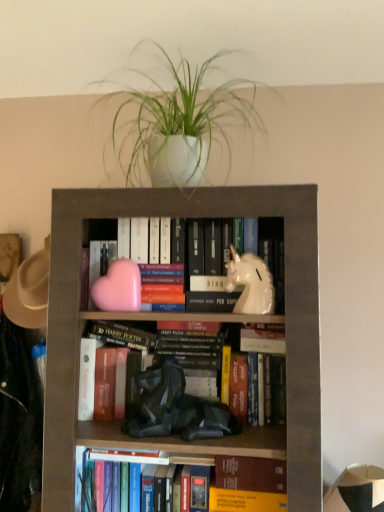
Question: Is brown felt hat at left surrounding white glossy unicorn at center-right, marked as the 1th animal in a right-to-left arrangement?

Choices:
 (A) yes
 (B) no

Answer: (B)

Question: Would you say brown felt hat at left is outside white glossy unicorn at center-right, marked as the 1th animal in a right-to-left arrangement?

Choices:
 (A) no
 (B) yes

Answer: (B)

Question: Considering the relative sizes of brown felt hat at left and white glossy unicorn at center-right, marked as the 1th animal in a right-to-left arrangement, in the image provided, is brown felt hat at left bigger than white glossy unicorn at center-right, marked as the 1th animal in a right-to-left arrangement,?

Choices:
 (A) no
 (B) yes

Answer: (B)

Question: Does brown felt hat at left appear on the right side of white glossy unicorn at center-right, the 2th animal in the left-to-right sequence?

Choices:
 (A) no
 (B) yes

Answer: (A)

Question: Can you confirm if brown felt hat at left is thinner than white glossy unicorn at center-right, marked as the 1th animal in a right-to-left arrangement?

Choices:
 (A) no
 (B) yes

Answer: (A)

Question: From a real-world perspective, is brown felt hat at left under white glossy unicorn at center-right, marked as the 1th animal in a right-to-left arrangement?

Choices:
 (A) no
 (B) yes

Answer: (B)

Question: From the image's perspective, does white matte plant at upper center appear higher than matte gray bookcase at center?

Choices:
 (A) yes
 (B) no

Answer: (A)

Question: Considering the relative positions of white matte plant at upper center and matte gray bookcase at center in the image provided, is white matte plant at upper center to the right of matte gray bookcase at center from the viewer's perspective?

Choices:
 (A) yes
 (B) no

Answer: (B)

Question: From the image's perspective, is white matte plant at upper center under matte gray bookcase at center?

Choices:
 (A) no
 (B) yes

Answer: (A)

Question: Is white matte plant at upper center not within matte gray bookcase at center?

Choices:
 (A) no
 (B) yes

Answer: (B)

Question: Is white matte plant at upper center oriented away from matte gray bookcase at center?

Choices:
 (A) no
 (B) yes

Answer: (A)

Question: Is white matte plant at upper center positioned in front of matte gray bookcase at center?

Choices:
 (A) no
 (B) yes

Answer: (A)

Question: From a real-world perspective, is matte gray bookcase at center on top of white glossy unicorn at center-right, the 2th animal in the left-to-right sequence?

Choices:
 (A) no
 (B) yes

Answer: (A)